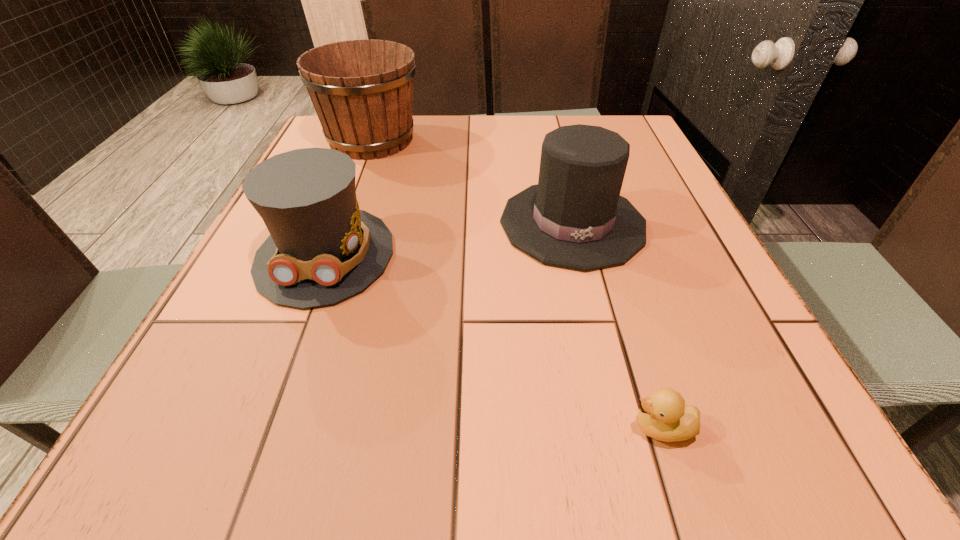
Find the location of a particular element. The height and width of the screenshot is (540, 960). the farthest object is located at coordinates (362, 90).

Where is `the right dress hat`? The height and width of the screenshot is (540, 960). the right dress hat is located at coordinates (575, 218).

Find the location of a particular element. The image size is (960, 540). the left dress hat is located at coordinates (322, 249).

The height and width of the screenshot is (540, 960). Find the location of `the shortest object`. the shortest object is located at coordinates (663, 416).

Locate an element on the screen. The image size is (960, 540). the nearest object is located at coordinates 663,416.

In order to click on free point located 0.170m on the front of the wine bucket in this screenshot , I will do `click(347, 205)`.

Identify the location of vacant space situated on the front of the right dress hat with the decoration. (601, 340).

At what (x,y) coordinates should I click in order to perform the action: click on vacant space situated with goggles on the front of the left dress hat. Please return your answer as a coordinate pair (x, y). Looking at the image, I should click on (277, 380).

Image resolution: width=960 pixels, height=540 pixels. Find the location of `vacant space situated 0.190m on the face of the shortest object`. vacant space situated 0.190m on the face of the shortest object is located at coordinates (493, 428).

At what (x,y) coordinates should I click in order to perform the action: click on vacant area situated on the face of the shortest object. Please return your answer as a coordinate pair (x, y). Looking at the image, I should click on click(x=400, y=428).